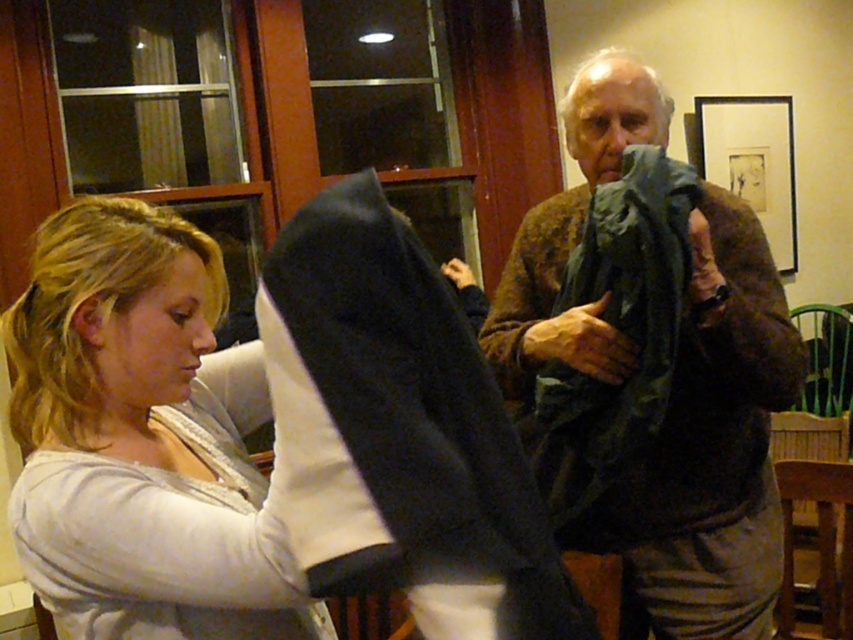
Which of these two, textured brown sweater at upper right or dark green fabric at center, stands taller?

textured brown sweater at upper right

Is point (660, 506) closer to camera compared to point (554, 429)?

No, (660, 506) is behind (554, 429).

Where is `textured brown sweater at upper right`? The height and width of the screenshot is (640, 853). textured brown sweater at upper right is located at coordinates (709, 451).

Is point (479, 556) closer to viewer compared to point (666, 365)?

Yes, it is.

Measure the distance from black soft fabric at center to dark green fabric at center.

They are 27.22 inches apart.

Describe the element at coordinates (399, 433) in the screenshot. I see `black soft fabric at center` at that location.

Locate an element on the screen. The height and width of the screenshot is (640, 853). black soft fabric at center is located at coordinates (399, 433).

Is black soft fabric at center wider than textured brown sweater at upper right?

No, black soft fabric at center is not wider than textured brown sweater at upper right.

Can you confirm if black soft fabric at center is taller than textured brown sweater at upper right?

In fact, black soft fabric at center may be shorter than textured brown sweater at upper right.

Image resolution: width=853 pixels, height=640 pixels. What are the coordinates of `black soft fabric at center` in the screenshot? It's located at [399, 433].